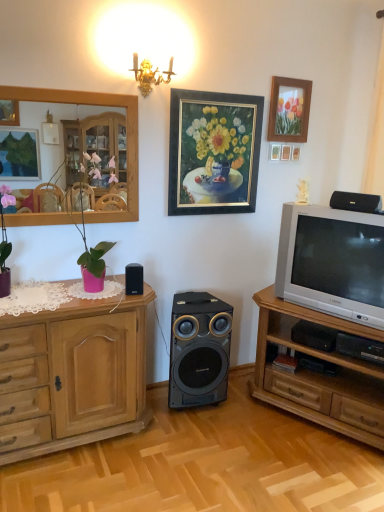
Find the location of a particular element. This screenshot has height=512, width=384. free spot to the right of black plastic speaker at center, acting as the first loudspeaker starting from the back is located at coordinates (249, 410).